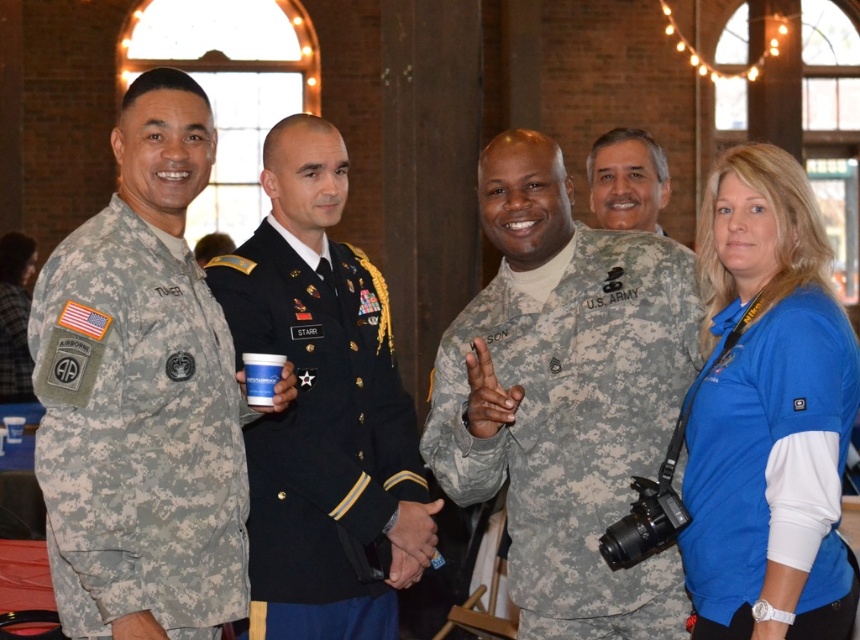
You are standing in the room with the group of five people. You want to take a photo of the point at coordinates point (x=392, y=508). If your camera has a maximum focus range of 40 meters, will it be able to focus on that point?

The distance of point (x=392, y=508) from viewer is 39.88 meters, which is within the camera maximum focus range of 40 meters. Therefore, the camera can focus on that point.

You are organizing a photo shoot and need to arrange two uniforms in the center of the image. The black silk uniform at center must be placed in front of the camouflage uniform at center. Is this arrangement possible given their sizes?

The black silk uniform at center is smaller than the camouflage uniform at center, so yes, it can be placed in front without completely obscuring the larger one.

You are organizing a photo shoot and need to ensure that all clothing items in the scene are visible in the final image. Given the blue polyester shirt at upper right and the black silk uniform at center, which clothing item might require a wider angle lens to capture fully?

The blue polyester shirt at upper right occupies less space than the black silk uniform at center, so the black silk uniform at center might require a wider angle lens to capture fully because it takes up more of the frame.